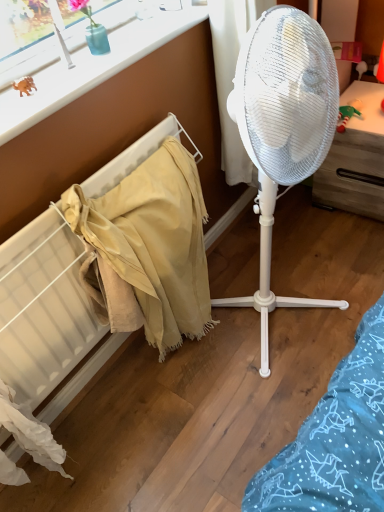
Question: Can you confirm if white plastic fan at center is smaller than rubber orange dinosaur at upper left?

Choices:
 (A) no
 (B) yes

Answer: (A)

Question: Is the position of white plastic fan at center more distant than that of rubber orange dinosaur at upper left?

Choices:
 (A) no
 (B) yes

Answer: (A)

Question: Is white plastic fan at center looking in the opposite direction of rubber orange dinosaur at upper left?

Choices:
 (A) no
 (B) yes

Answer: (A)

Question: From the image's perspective, is white plastic fan at center located beneath rubber orange dinosaur at upper left?

Choices:
 (A) yes
 (B) no

Answer: (A)

Question: Considering the relative positions of white plastic fan at center and rubber orange dinosaur at upper left in the image provided, is white plastic fan at center to the left of rubber orange dinosaur at upper left from the viewer's perspective?

Choices:
 (A) no
 (B) yes

Answer: (A)

Question: Is rubber orange dinosaur at upper left taller or shorter than beige fabric at left?

Choices:
 (A) tall
 (B) short

Answer: (B)

Question: From a real-world perspective, relative to beige fabric at left, is rubber orange dinosaur at upper left vertically above or below?

Choices:
 (A) below
 (B) above

Answer: (B)

Question: Is rubber orange dinosaur at upper left bigger or smaller than beige fabric at left?

Choices:
 (A) small
 (B) big

Answer: (A)

Question: Is rubber orange dinosaur at upper left spatially inside beige fabric at left, or outside of it?

Choices:
 (A) outside
 (B) inside

Answer: (A)

Question: Is point (119, 64) positioned closer to the camera than point (158, 266)?

Choices:
 (A) closer
 (B) farther

Answer: (A)

Question: In terms of height, does white plastic window frame at upper left look taller or shorter compared to beige fabric at left?

Choices:
 (A) tall
 (B) short

Answer: (B)

Question: In terms of width, does white plastic window frame at upper left look wider or thinner when compared to beige fabric at left?

Choices:
 (A) wide
 (B) thin

Answer: (A)

Question: From a real-world perspective, is white plastic window frame at upper left positioned above or below beige fabric at left?

Choices:
 (A) below
 (B) above

Answer: (B)

Question: In terms of height, does rubber orange dinosaur at upper left look taller or shorter compared to white plastic drawer at right?

Choices:
 (A) short
 (B) tall

Answer: (A)

Question: In terms of size, does rubber orange dinosaur at upper left appear bigger or smaller than white plastic drawer at right?

Choices:
 (A) small
 (B) big

Answer: (A)